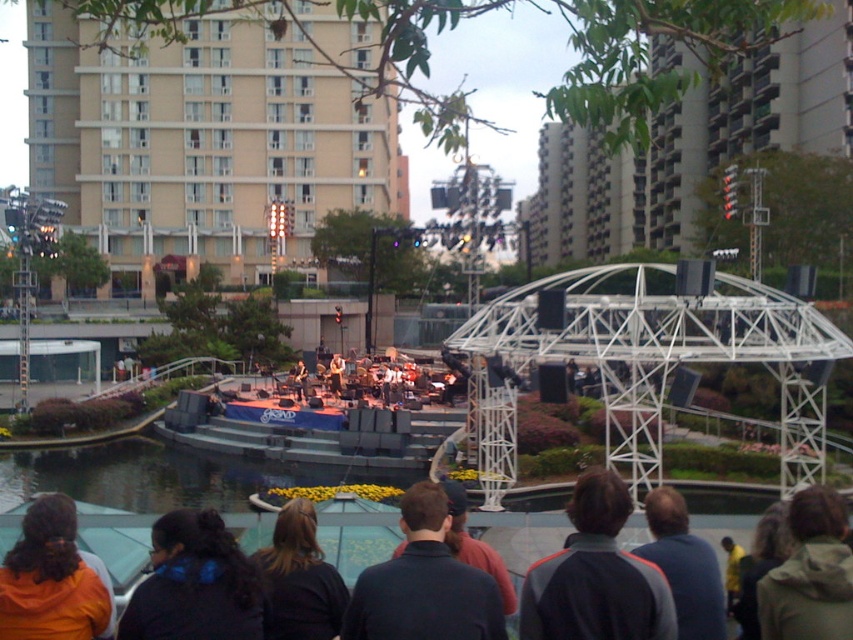
Question: Which object appears closest to the camera in this image?

Choices:
 (A) black fabric at center
 (B) green fuzzy jacket at lower right
 (C) dark blue jacket at lower center
 (D) dark gray jacket at center

Answer: (D)

Question: Does dark blue jacket at lower center appear under orange fleece jacket at lower left?

Choices:
 (A) no
 (B) yes

Answer: (B)

Question: Does dark blue jacket at lower center appear on the right side of dark brown hair at center?

Choices:
 (A) no
 (B) yes

Answer: (B)

Question: Based on their relative distances, which object is nearer to the black fabric at center?

Choices:
 (A) dark brown hair at center
 (B) orange fleece jacket at lower left
 (C) dark blue shirt at center

Answer: (A)

Question: Does dark blue jacket at lower center have a larger size compared to black fabric at center?

Choices:
 (A) yes
 (B) no

Answer: (A)

Question: Which point is closer to the camera?

Choices:
 (A) (627, 496)
 (B) (138, 637)
 (C) (84, 596)
 (D) (323, 545)

Answer: (B)